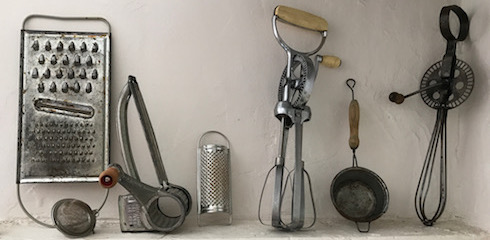
Identify the location of hold egg beater here. click(x=304, y=24), click(x=453, y=9).